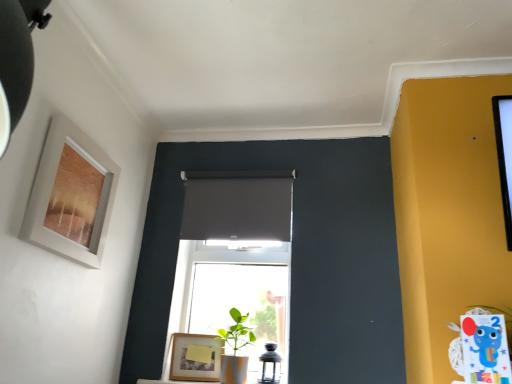
Question: From the image's perspective, is green matte plant pot at center located above green matte plant at center?

Choices:
 (A) no
 (B) yes

Answer: (A)

Question: Does green matte plant pot at center contain green matte plant at center?

Choices:
 (A) yes
 (B) no

Answer: (B)

Question: Is green matte plant pot at center to the right of green matte plant at center from the viewer's perspective?

Choices:
 (A) yes
 (B) no

Answer: (B)

Question: Is green matte plant pot at center not within green matte plant at center?

Choices:
 (A) no
 (B) yes

Answer: (B)

Question: Could you tell me if green matte plant pot at center is facing green matte plant at center?

Choices:
 (A) yes
 (B) no

Answer: (B)

Question: Considering the relative sizes of green matte plant pot at center and green matte plant at center in the image provided, is green matte plant pot at center shorter than green matte plant at center?

Choices:
 (A) no
 (B) yes

Answer: (A)

Question: Is green matte plant at center beside green matte plant pot at center?

Choices:
 (A) yes
 (B) no

Answer: (B)

Question: Is the depth of green matte plant at center less than that of green matte plant pot at center?

Choices:
 (A) no
 (B) yes

Answer: (B)

Question: Would you say green matte plant at center is a long distance from green matte plant pot at center?

Choices:
 (A) yes
 (B) no

Answer: (A)

Question: Does green matte plant at center turn towards green matte plant pot at center?

Choices:
 (A) no
 (B) yes

Answer: (A)

Question: Is green matte plant pot at center at the back of green matte plant at center?

Choices:
 (A) yes
 (B) no

Answer: (B)

Question: From a real-world perspective, is green matte plant at center below green matte plant pot at center?

Choices:
 (A) no
 (B) yes

Answer: (A)

Question: Is wooden frame at lower center, which is the 2th picture frame in front-to-back order, positioned in front of matte gray curtain at center?

Choices:
 (A) no
 (B) yes

Answer: (B)